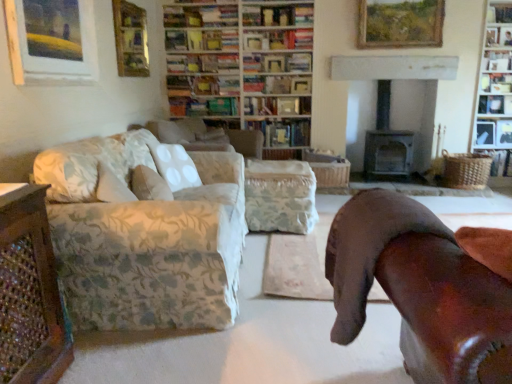
Question: Is point (498, 168) positioned closer to the camera than point (125, 34)?

Choices:
 (A) closer
 (B) farther

Answer: (B)

Question: Choose the correct answer: Is woven brown basket at right, the first book from the right, inside wooden picture frame at upper left, positioned as the second picture frame in front-to-back order, or outside it?

Choices:
 (A) outside
 (B) inside

Answer: (A)

Question: Estimate the real-world distances between objects in this image. Which object is closer to the wooden bookshelf at upper right, arranged as the first shelf when viewed from the top?

Choices:
 (A) floral fabric couch at left
 (B) hardcover book at center, which appears as the second book when viewed from the left
 (C) wooden picture frame at upper left, the fourth picture frame from the back
 (D) wooden shelf at upper right, placed as the 2th shelf when sorted from bottom to top
 (E) hardcover book at center, the 1th book viewed from the left

Answer: (D)

Question: Considering the real-world distances, which object is farthest from the hardcover book at center, the 1th book viewed from the left?

Choices:
 (A) floral fabric ottoman at center
 (B) wooden shelf at upper right, the 3th shelf when ordered from top to bottom
 (C) wooden bookshelf at upper center, arranged as the second bookcase when viewed from the right
 (D) woven brown basket at right, acting as the fifth book starting from the left
 (E) wooden picture frame at upper left, arranged as the second picture frame when viewed from the left

Answer: (D)